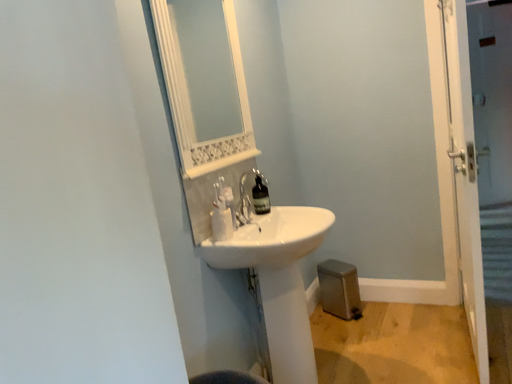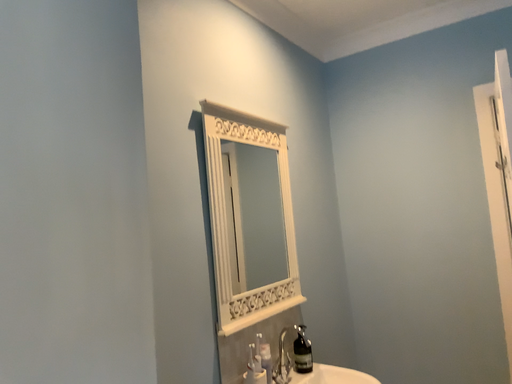
Question: Which way did the camera rotate in the video?

Choices:
 (A) rotated upward
 (B) rotated downward

Answer: (A)